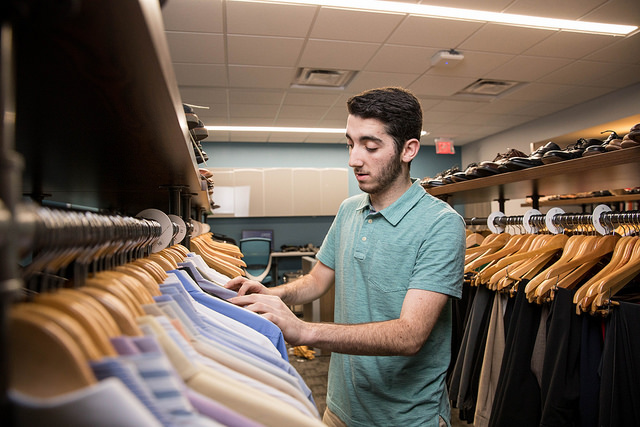
Image resolution: width=640 pixels, height=427 pixels. I want to click on vent, so click(492, 91).